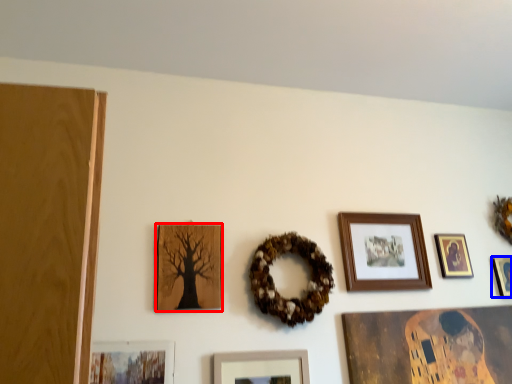
Question: Which object is further to the camera taking this photo, picture frame (highlighted by a red box) or picture frame (highlighted by a blue box)?

Choices:
 (A) picture frame
 (B) picture frame

Answer: (B)